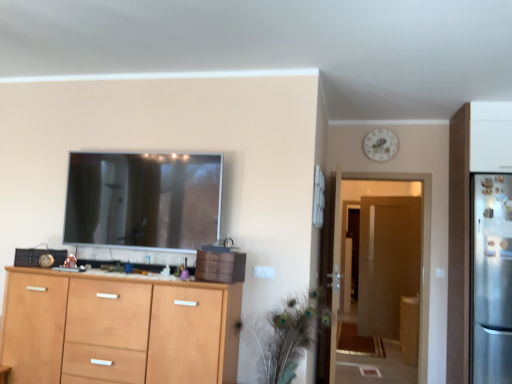
Question: Considering the relative positions of light wood cabinet at lower left, which is counted as the 2th cabinetry, starting from the right, and white glossy clock at upper center in the image provided, is light wood cabinet at lower left, which is counted as the 2th cabinetry, starting from the right, to the left or to the right of white glossy clock at upper center?

Choices:
 (A) right
 (B) left

Answer: (B)

Question: Relative to white glossy clock at upper center, is light wood cabinet at lower left, the 2th cabinetry in the back-to-front sequence, in front or behind?

Choices:
 (A) front
 (B) behind

Answer: (A)

Question: Considering the real-world distances, which object is closest to the white glossy clock at upper center?

Choices:
 (A) green feathered plant at center
 (B) brown wooden door at center
 (C) satin silver refrigerator at right
 (D) light wood cabinet at lower left, which ranks as the second cabinetry in bottom-to-top order
 (E) brown matte drawer at center

Answer: (C)

Question: Based on their relative distances, which object is nearer to the wooden cabinet at center?

Choices:
 (A) wooden cabinet at right, arranged as the second cabinetry when viewed from the left
 (B) white glossy clock at upper center
 (C) brown wooden door at center
 (D) light wood cabinet at lower left, the 2th cabinetry in the back-to-front sequence
 (E) green feathered plant at center

Answer: (D)